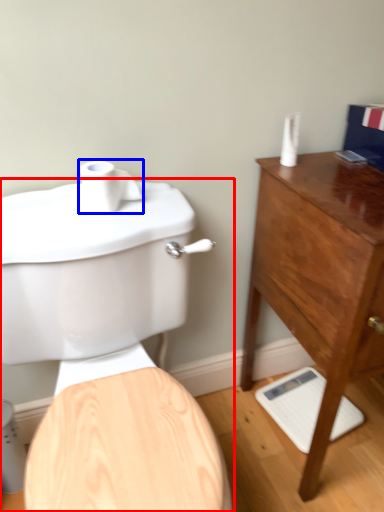
Question: Which point is closer to the camera, toilet (highlighted by a red box) or toilet paper (highlighted by a blue box)?

Choices:
 (A) toilet
 (B) toilet paper

Answer: (A)